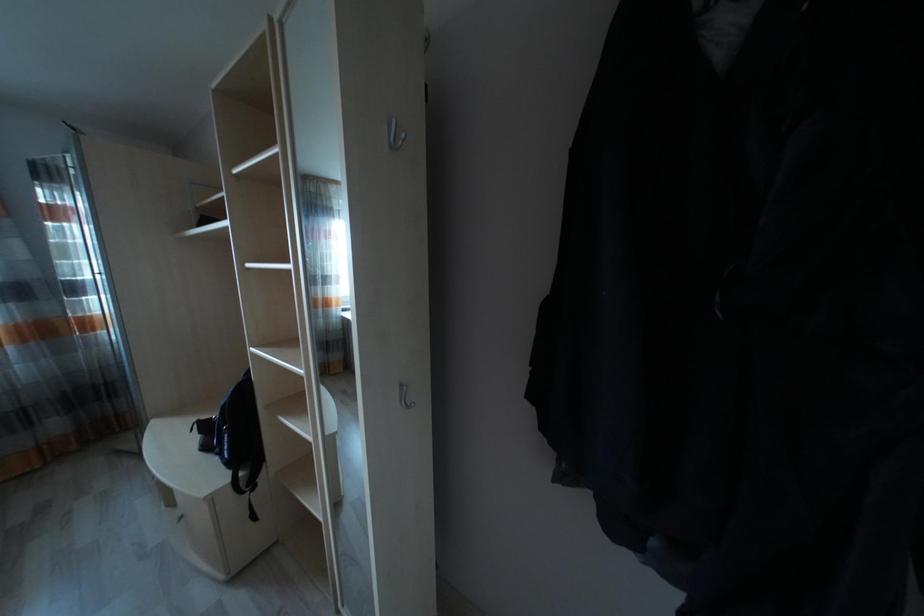
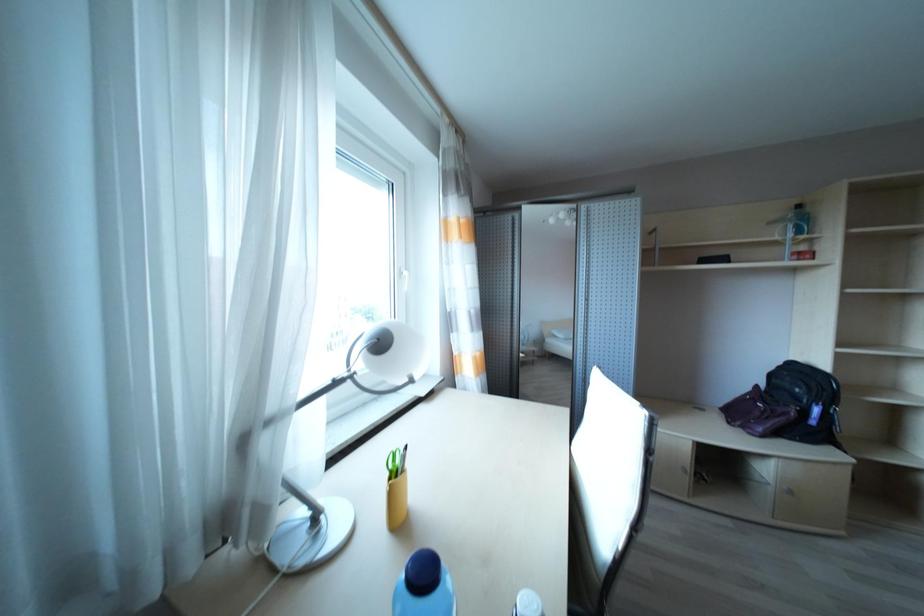
Question: What movement of the cameraman would produce the second image?

Choices:
 (A) Left
 (B) Right
 (C) Forward
 (D) Backward

Answer: (A)